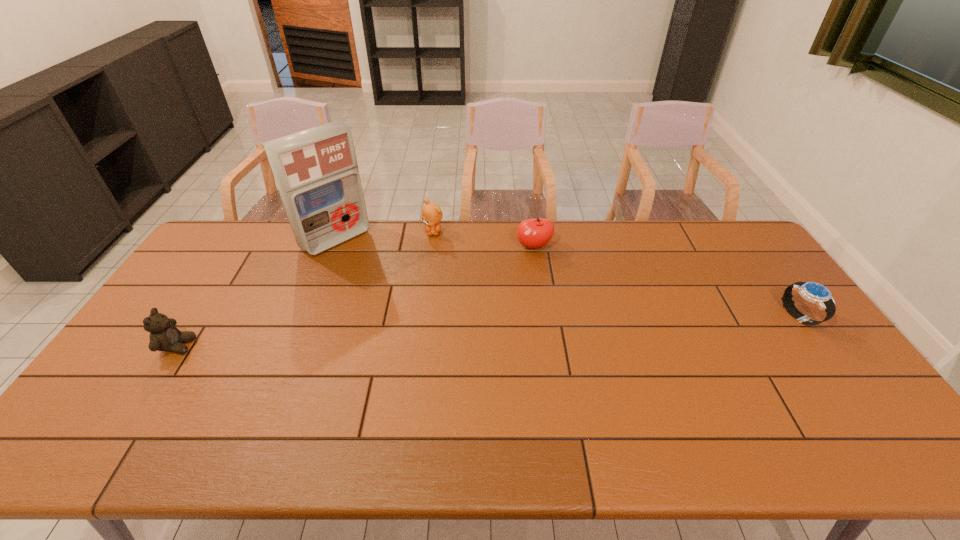
Locate an element on the screen. The width and height of the screenshot is (960, 540). free space located on the back of the watch is located at coordinates (780, 290).

The image size is (960, 540). I want to click on vacant area situated 0.280m on the stem of the apple, so click(550, 314).

Find the location of a particular element. The image size is (960, 540). vacant space located on the stem of the apple is located at coordinates (540, 272).

Image resolution: width=960 pixels, height=540 pixels. What are the coordinates of `free spot located 0.390m on the stem of the apple` in the screenshot? It's located at (557, 343).

Image resolution: width=960 pixels, height=540 pixels. In order to click on free space located 0.350m on the face of the farther teddy bear in this screenshot , I will do `click(426, 308)`.

You are a GUI agent. You are given a task and a screenshot of the screen. Output one action in this format:
    pyautogui.click(x=<x>, y=<y>)
    Task: Click on the vacant point located on the face of the farther teddy bear
    The width and height of the screenshot is (960, 540).
    Given the screenshot: What is the action you would take?
    pyautogui.click(x=431, y=259)

Identify the location of free space located on the face of the farther teddy bear. (428, 287).

Locate an element on the screen. The width and height of the screenshot is (960, 540). vacant point located on the front-facing side of the first-aid kit is located at coordinates (393, 289).

Where is `vacant space located 0.290m on the front-facing side of the first-aid kit`? vacant space located 0.290m on the front-facing side of the first-aid kit is located at coordinates pyautogui.click(x=401, y=297).

This screenshot has height=540, width=960. In order to click on blank space located 0.070m on the front-facing side of the first-aid kit in this screenshot , I will do `click(364, 264)`.